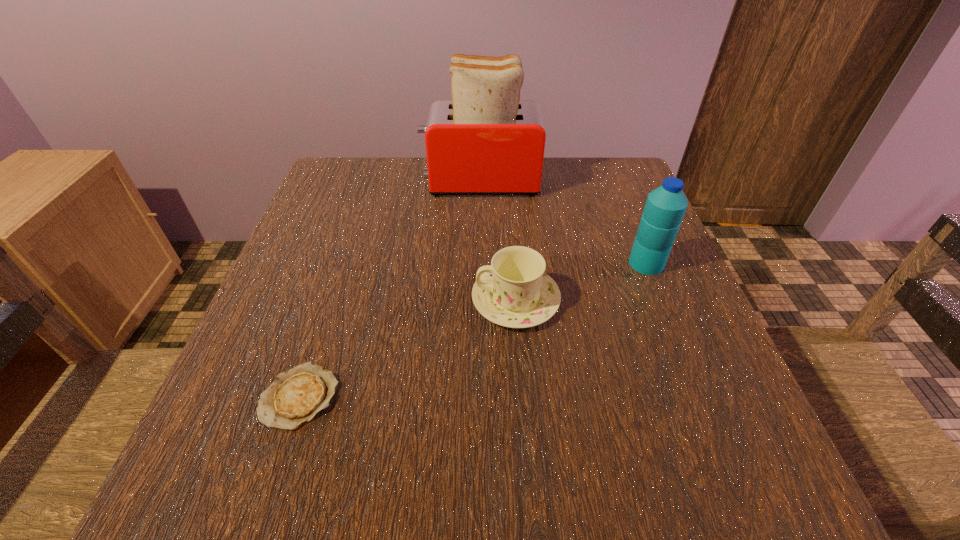
This screenshot has width=960, height=540. In order to click on free space that satisfies the following two spatial constraints: 1. on the front-facing side of the toaster; 2. on the left side of the rightmost object in this screenshot , I will do `click(480, 264)`.